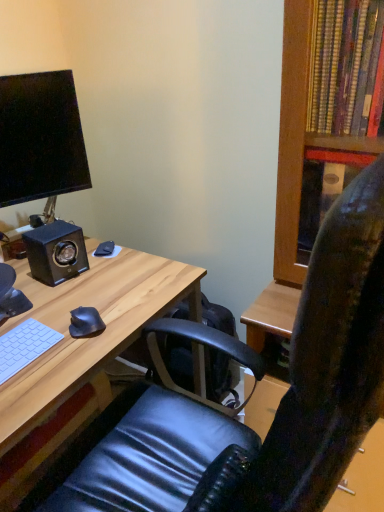
This screenshot has width=384, height=512. In order to click on vacant space that's between black matte speaker at left and white matte keyboard at lower left in this screenshot , I will do `click(46, 304)`.